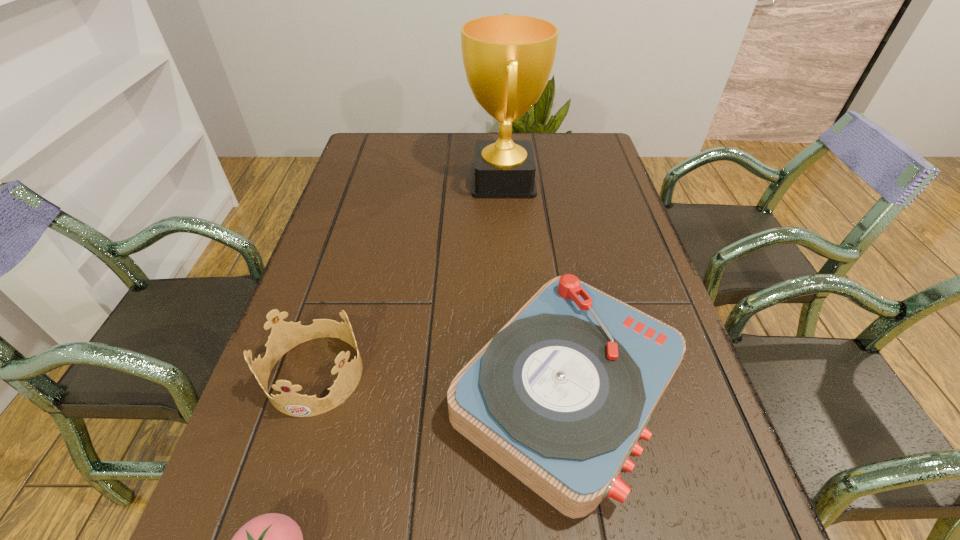
At what (x,y) coordinates should I click in order to perform the action: click on object located at the left edge. Please return your answer as a coordinate pair (x, y). Looking at the image, I should click on (284, 336).

Find the location of `object situated at the right edge`. object situated at the right edge is located at coordinates (559, 397).

Locate an element on the screen. free space at the far edge of the desktop is located at coordinates (410, 134).

Locate an element on the screen. free spot at the left edge of the desktop is located at coordinates (357, 215).

Find the location of a particular element. This screenshot has height=540, width=960. vacant position at the right edge of the desktop is located at coordinates 669,426.

What are the coordinates of `vacant region at the far left corner of the desktop` in the screenshot? It's located at (370, 149).

You are a GUI agent. You are given a task and a screenshot of the screen. Output one action in this format:
    pyautogui.click(x=<x>, y=<y>)
    Task: Click on the free space at the far right corner of the desktop
    
    Given the screenshot: What is the action you would take?
    pyautogui.click(x=597, y=137)

Where is `vacant region between the tiara and the award`? Image resolution: width=960 pixels, height=540 pixels. vacant region between the tiara and the award is located at coordinates (410, 277).

Locate an element on the screen. Image resolution: width=960 pixels, height=540 pixels. vacant space in between the tiara and the award is located at coordinates (410, 277).

The image size is (960, 540). Find the location of `vacant area that lies between the record player and the tiara`. vacant area that lies between the record player and the tiara is located at coordinates (441, 383).